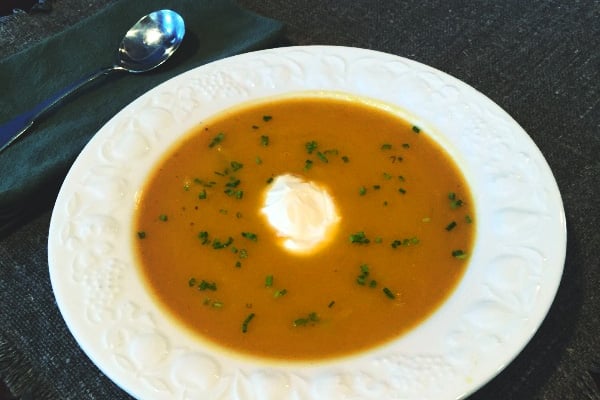
In order to click on table in this screenshot , I will do `click(564, 299)`, `click(537, 62)`, `click(32, 362)`.